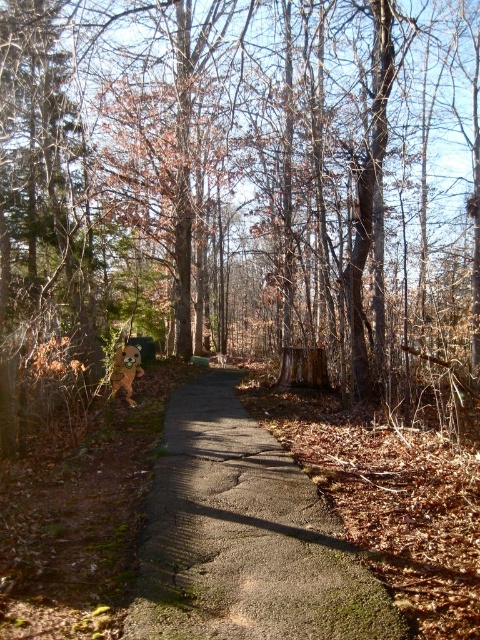
Based on the photo, can you confirm if brown rough wood at center is positioned to the left of brown furry dog at center?

No, brown rough wood at center is not to the left of brown furry dog at center.

Does point (316, 353) come closer to viewer compared to point (131, 360)?

That is False.

The height and width of the screenshot is (640, 480). Identify the location of brown rough wood at center. (303, 368).

Which is more to the left, brown wood tree at center or brown rough wood at center?

brown wood tree at center is more to the left.

Can you confirm if brown wood tree at center is thinner than brown rough wood at center?

No, brown wood tree at center is not thinner than brown rough wood at center.

The image size is (480, 640). In order to click on brown wood tree at center in this screenshot , I will do [228, 173].

Can you confirm if brown wood tree at center is positioned below brown furry dog at center?

Incorrect, brown wood tree at center is not positioned below brown furry dog at center.

Who is more forward, (x=60, y=33) or (x=122, y=385)?

Point (x=122, y=385) is in front.

Does point (90, 184) lie in front of point (131, 376)?

No, it is not.

The width and height of the screenshot is (480, 640). I want to click on brown wood tree at center, so click(228, 173).